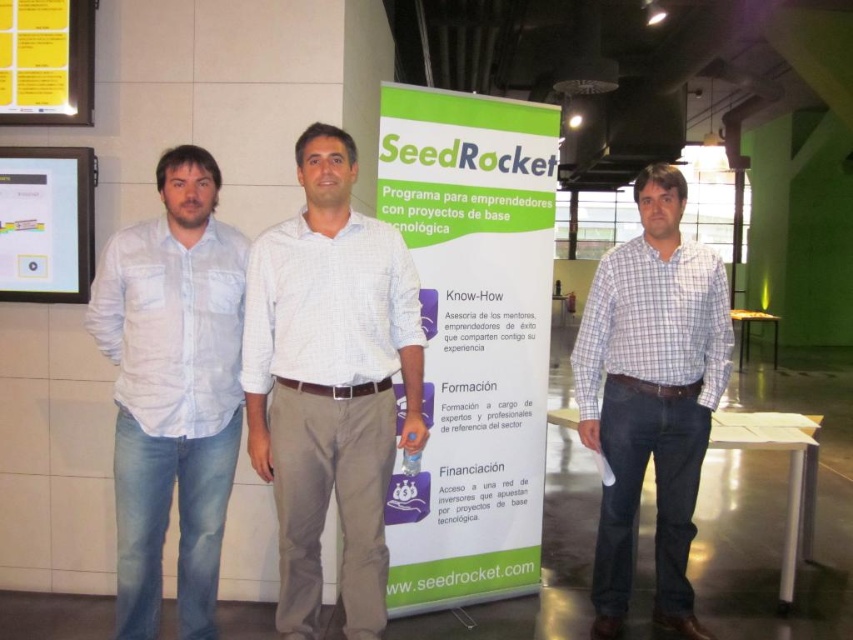
Question: Estimate the real-world distances between objects in this image. Which object is farther from the matte plastic screen at left?

Choices:
 (A) white checkered shirt at center
 (B) green paperboard at center
 (C) light blue cotton shirt at left
 (D) checkered fabric shirt at center

Answer: (D)

Question: Which point is farther to the camera?

Choices:
 (A) white checkered shirt at center
 (B) light blue cotton shirt at left
 (C) matte plastic screen at left
 (D) green paperboard at center

Answer: (C)

Question: Does green paperboard at center have a larger size compared to white checkered shirt at center?

Choices:
 (A) yes
 (B) no

Answer: (A)

Question: Which point appears closest to the camera in this image?

Choices:
 (A) (80, 156)
 (B) (666, 468)
 (C) (129, 228)
 (D) (543, 198)

Answer: (C)

Question: Is white checkered shirt at center bigger than light blue cotton shirt at left?

Choices:
 (A) no
 (B) yes

Answer: (A)

Question: Is green paperboard at center above white checkered shirt at center?

Choices:
 (A) yes
 (B) no

Answer: (A)